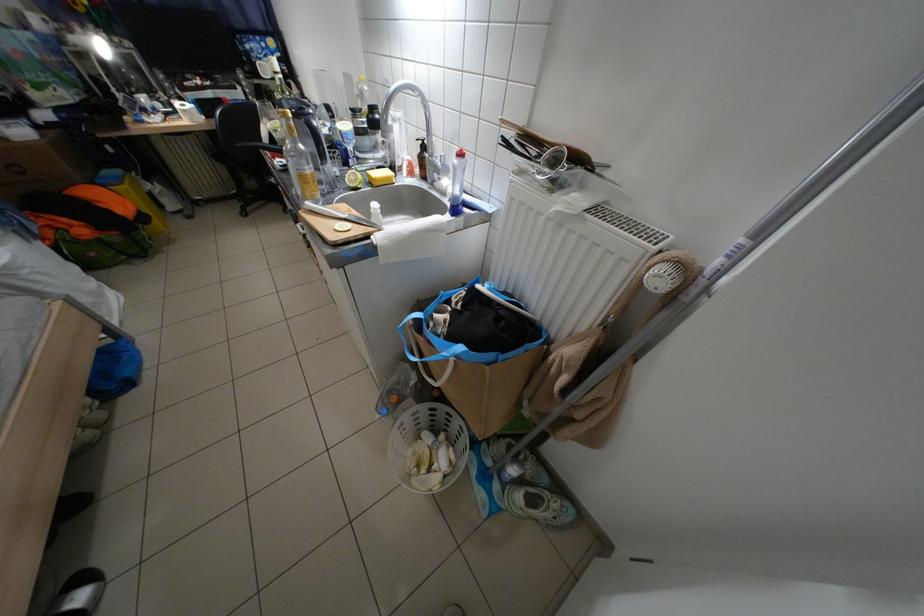
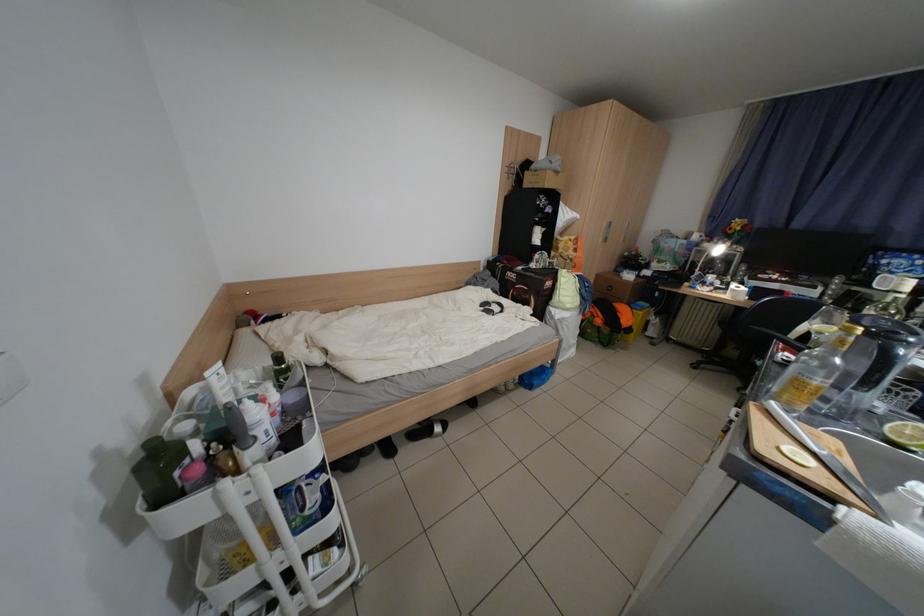
The point at (x=289, y=161) is marked in the first image. Where is the corresponding point in the second image?

(799, 355)